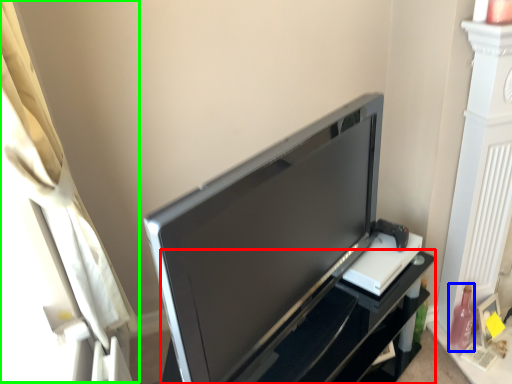
Question: Which object is positioned closest to furniture (highlighted by a red box)? Select from bottle (highlighted by a blue box) and curtain (highlighted by a green box).

Choices:
 (A) bottle
 (B) curtain

Answer: (A)